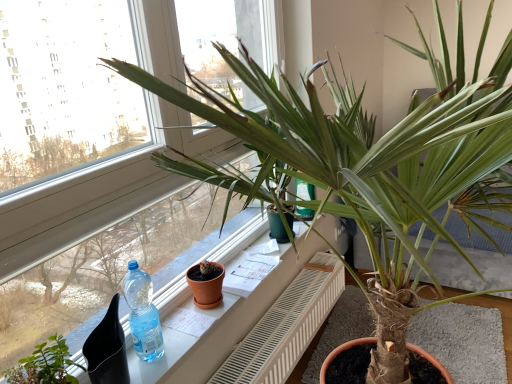
Question: Considering the relative positions of green matte plant at lower left and white plastic radiator at center in the image provided, is green matte plant at lower left to the right of white plastic radiator at center from the viewer's perspective?

Choices:
 (A) yes
 (B) no

Answer: (B)

Question: From a real-world perspective, is green matte plant at lower left beneath white plastic radiator at center?

Choices:
 (A) yes
 (B) no

Answer: (B)

Question: Is green matte plant at lower left far from white plastic radiator at center?

Choices:
 (A) no
 (B) yes

Answer: (A)

Question: Could you tell me if green matte plant at lower left is facing white plastic radiator at center?

Choices:
 (A) yes
 (B) no

Answer: (B)

Question: Would you say green matte plant at lower left is outside white plastic radiator at center?

Choices:
 (A) yes
 (B) no

Answer: (A)

Question: From a real-world perspective, is green matte plant at lower left located higher than white plastic radiator at center?

Choices:
 (A) yes
 (B) no

Answer: (A)

Question: Can we say terracotta clay pot at center lies outside white glossy window sill at center?

Choices:
 (A) yes
 (B) no

Answer: (A)

Question: From a real-world perspective, is terracotta clay pot at center below white glossy window sill at center?

Choices:
 (A) yes
 (B) no

Answer: (B)

Question: Could you tell me if terracotta clay pot at center is turned towards white glossy window sill at center?

Choices:
 (A) no
 (B) yes

Answer: (A)

Question: Is terracotta clay pot at center beside white glossy window sill at center?

Choices:
 (A) no
 (B) yes

Answer: (A)

Question: Considering the relative sizes of terracotta clay pot at center and white glossy window sill at center in the image provided, is terracotta clay pot at center shorter than white glossy window sill at center?

Choices:
 (A) no
 (B) yes

Answer: (A)

Question: Is terracotta clay pot at center taller than white glossy window sill at center?

Choices:
 (A) yes
 (B) no

Answer: (A)

Question: Can you confirm if green matte plant at lower left is smaller than transparent plastic bottle at window?

Choices:
 (A) no
 (B) yes

Answer: (A)